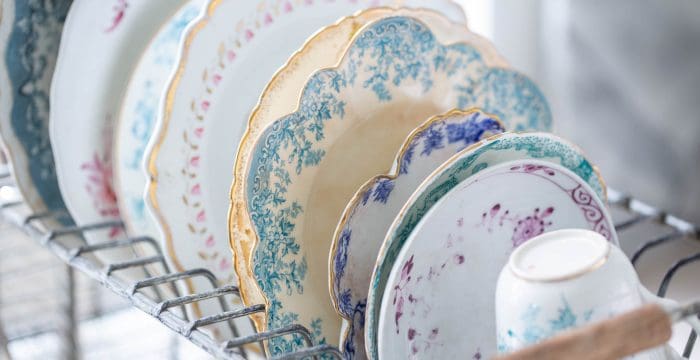
The width and height of the screenshot is (700, 360). Find the location of `plates`. plates is located at coordinates (28, 83), (88, 61), (154, 84), (227, 76), (316, 96), (326, 52), (435, 146), (448, 171), (455, 220).